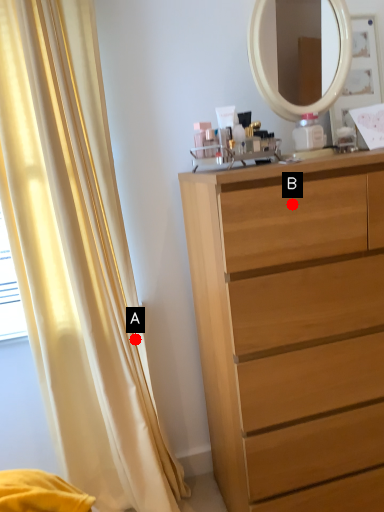
Question: Two points are circled on the image, labeled by A and B beside each circle. Which point appears farthest from the camera in this image?

Choices:
 (A) A is further
 (B) B is further

Answer: (A)